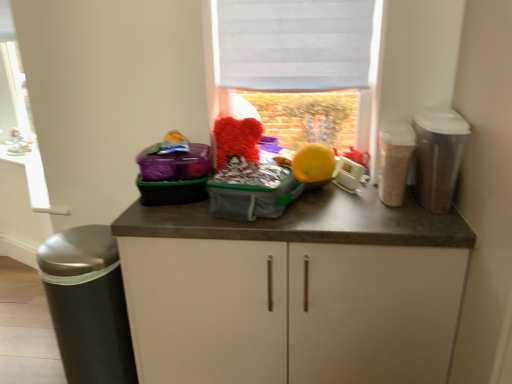
Identify the location of vacant area that is in front of translucent plastic container at right, placed as the 2th appliance when sorted from left to right. The width and height of the screenshot is (512, 384). pyautogui.click(x=404, y=226).